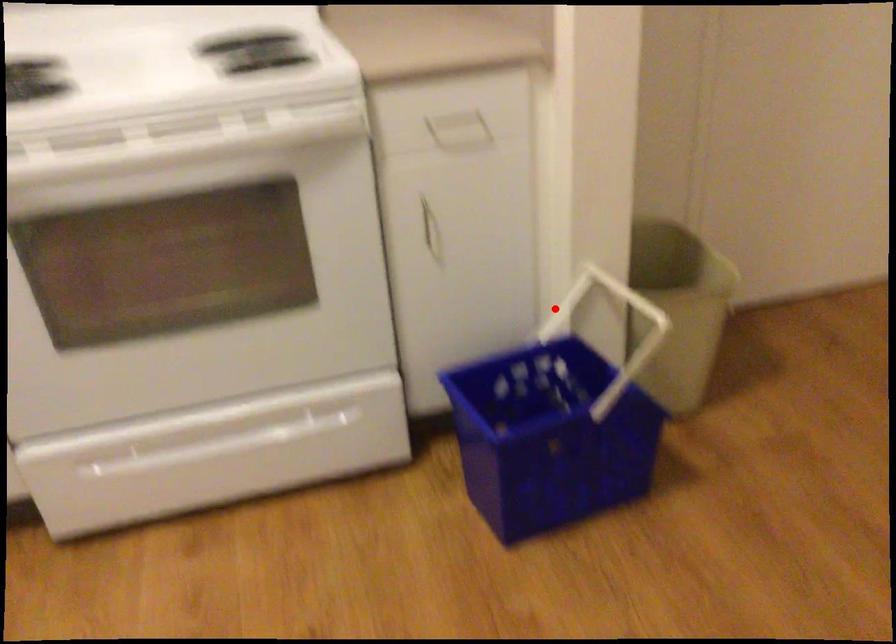
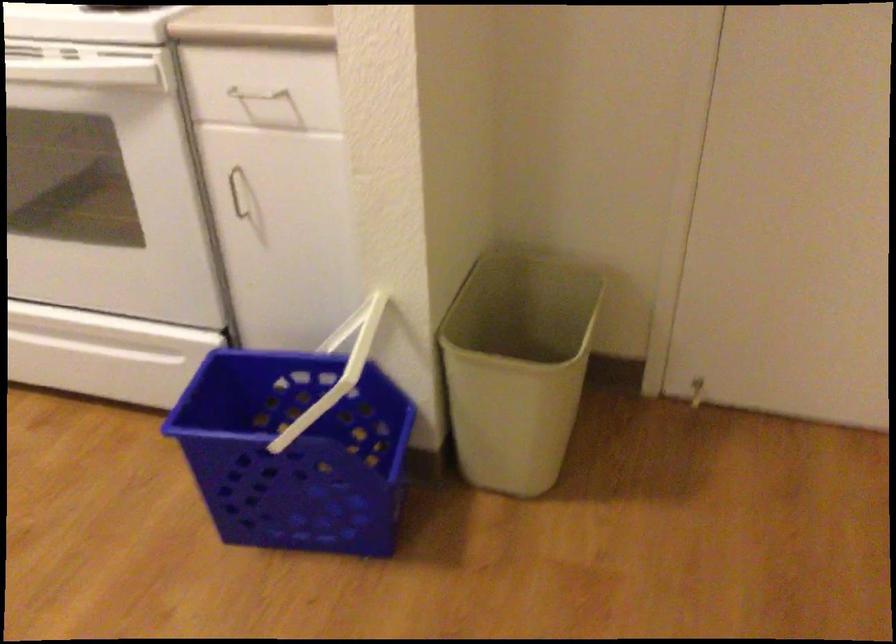
The point at the highlighted location is marked in the first image. Where is the corresponding point in the second image?

(346, 328)